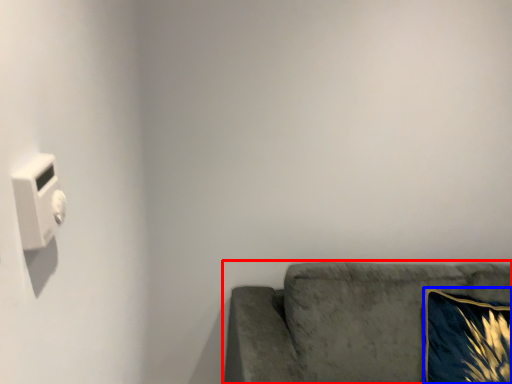
Question: Which object appears farthest to the camera in this image, studio couch (highlighted by a red box) or throw pillow (highlighted by a blue box)?

Choices:
 (A) studio couch
 (B) throw pillow

Answer: (B)